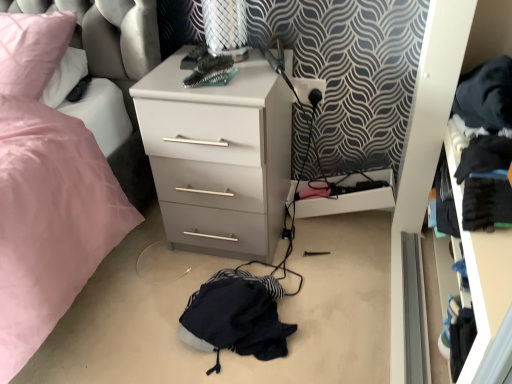
The height and width of the screenshot is (384, 512). In order to click on unoccupied region to the right of dark blue fabric at center in this screenshot , I will do `click(344, 312)`.